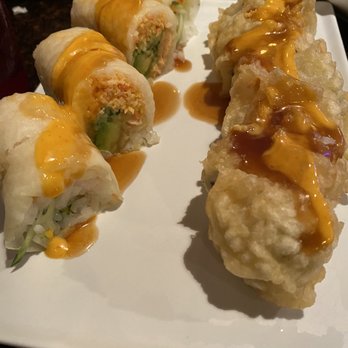
This screenshot has height=348, width=348. I want to click on plate, so click(x=148, y=242).